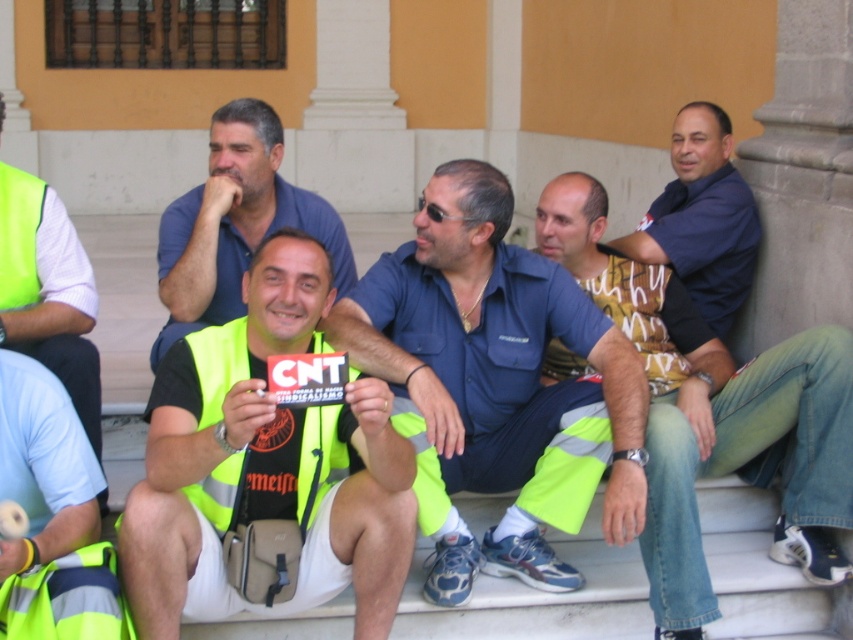
Who is higher up, matte blue shirt at center or blue shirt at upper right?

blue shirt at upper right is higher up.

This screenshot has width=853, height=640. I want to click on matte blue shirt at center, so click(234, 224).

Who is more forward, (196, 266) or (49, 208)?

Positioned in front is point (49, 208).

Which is behind, point (321, 198) or point (38, 305)?

Positioned behind is point (321, 198).

This screenshot has height=640, width=853. What do you see at coordinates (234, 224) in the screenshot?
I see `matte blue shirt at center` at bounding box center [234, 224].

The width and height of the screenshot is (853, 640). Identify the location of matte blue shirt at center. (234, 224).

Does blue fabric shirt at center appear over blue shirt at upper right?

Actually, blue fabric shirt at center is below blue shirt at upper right.

Is point (399, 420) closer to camera compared to point (694, 202)?

Yes, it is.

Identify the location of blue fabric shirt at center. (496, 384).